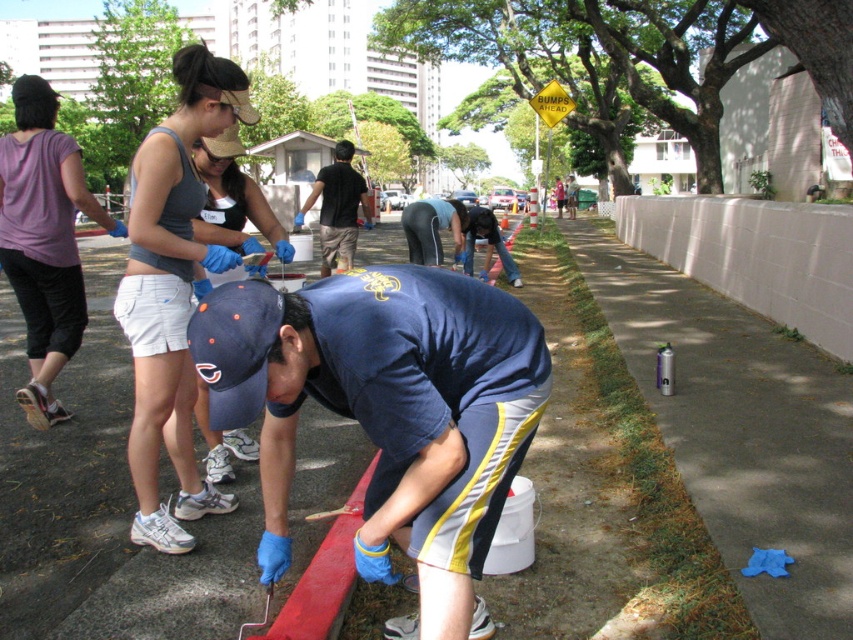
Which is more to the left, matte gray tank top at center or dark blue shirt at center?

Positioned to the left is dark blue shirt at center.

Locate an element on the screen. matte gray tank top at center is located at coordinates (172, 292).

Does point (276, 406) come in front of point (347, 221)?

Yes, it is.

Does blue fabric cap at center appear on the left side of dark blue shirt at center?

No, blue fabric cap at center is not to the left of dark blue shirt at center.

Where is `blue fabric cap at center`? blue fabric cap at center is located at coordinates (387, 413).

Identify the location of blue fabric cap at center. (387, 413).

Find the location of a particular element. blue fabric cap at center is located at coordinates (387, 413).